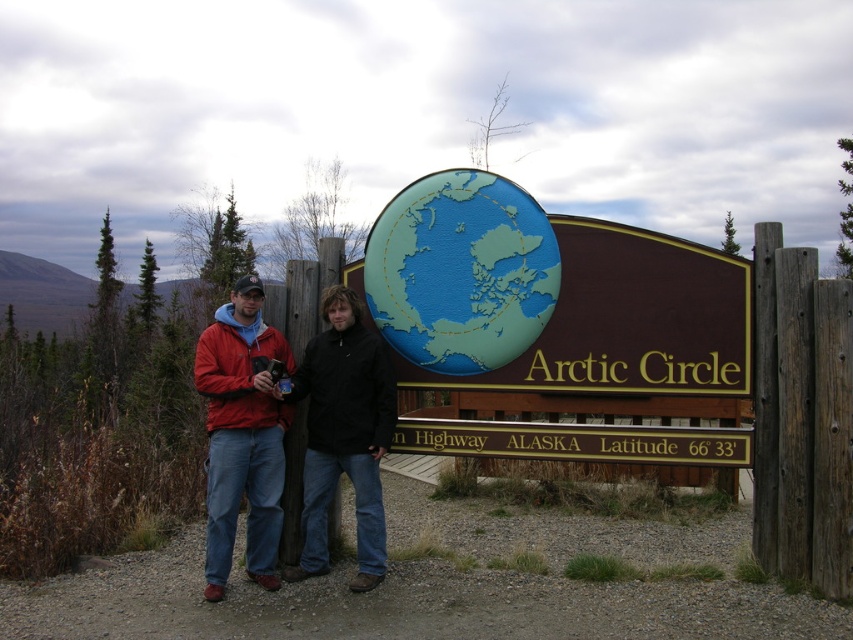
Does point (497, 340) come in front of point (247, 333)?

Yes, it is.

Image resolution: width=853 pixels, height=640 pixels. What do you see at coordinates (461, 272) in the screenshot? I see `matte blue globe at center` at bounding box center [461, 272].

Is point (483, 268) farther from camera compared to point (229, 472)?

Yes.

Where is `matte blue globe at center`? This screenshot has height=640, width=853. matte blue globe at center is located at coordinates (461, 272).

Is point (421, 280) positioned in front of point (265, 380)?

No.

In the scene shown: Who is more forward, (659, 260) or (225, 467)?

Point (659, 260) is more forward.

Is point (631, 337) farther from viewer compared to point (231, 321)?

No, (631, 337) is in front of (231, 321).

Image resolution: width=853 pixels, height=640 pixels. In order to click on brown wooden sign at center in this screenshot , I will do `click(547, 296)`.

Does point (521, 301) lie behind point (546, 221)?

Yes, point (521, 301) is behind point (546, 221).

Is brown wooden sign at center to the left of matte blue globe at center from the viewer's perspective?

→ Incorrect, brown wooden sign at center is not on the left side of matte blue globe at center.

Locate an element on the screen. This screenshot has height=640, width=853. brown wooden sign at center is located at coordinates (547, 296).